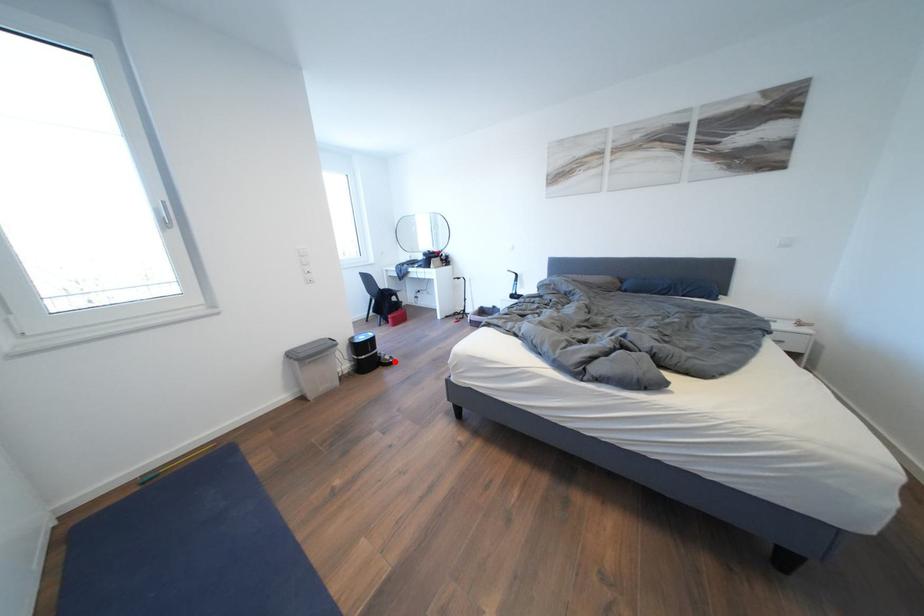
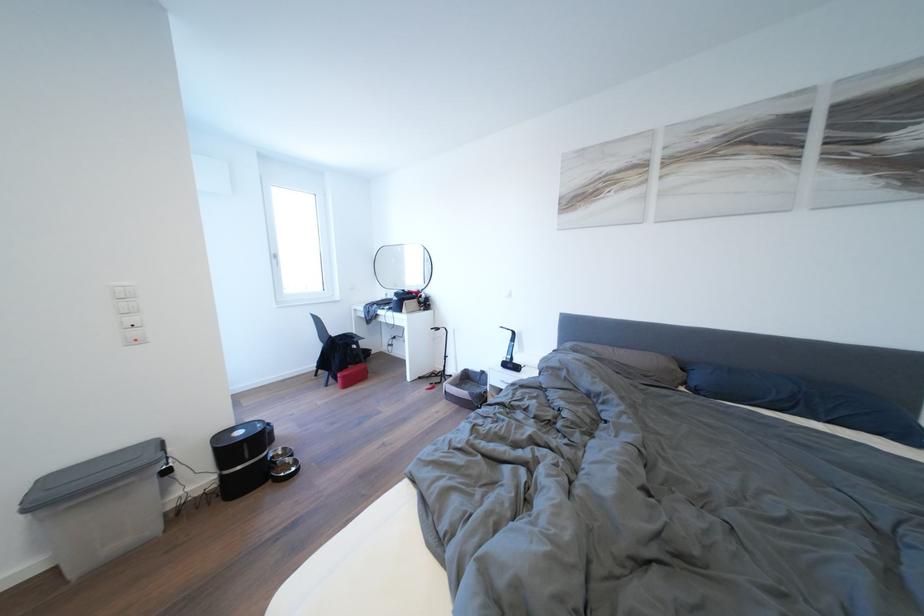
The point at the highlighted location is marked in the first image. Where is the corresponding point in the second image?

(296, 466)